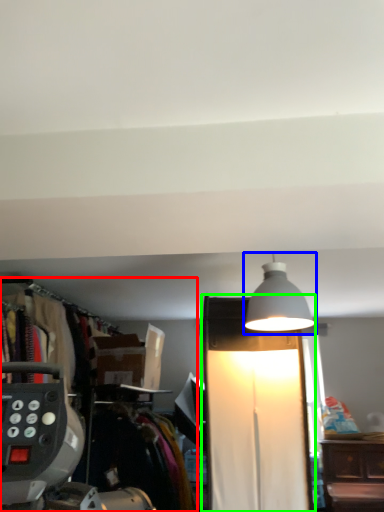
Question: Which is nearer to the closet (highlighted by a red box)? lamp (highlighted by a blue box) or lamp (highlighted by a green box).

Choices:
 (A) lamp
 (B) lamp

Answer: (B)